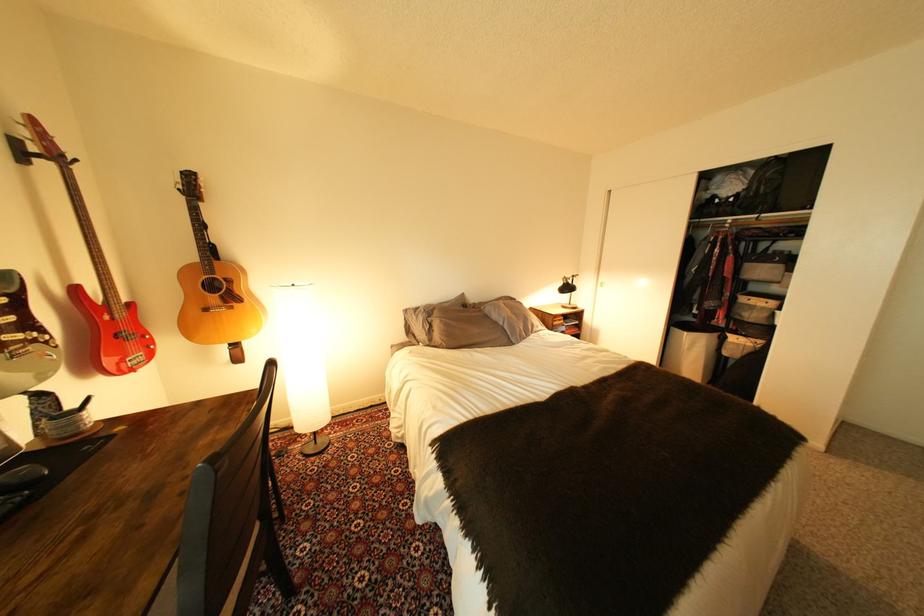
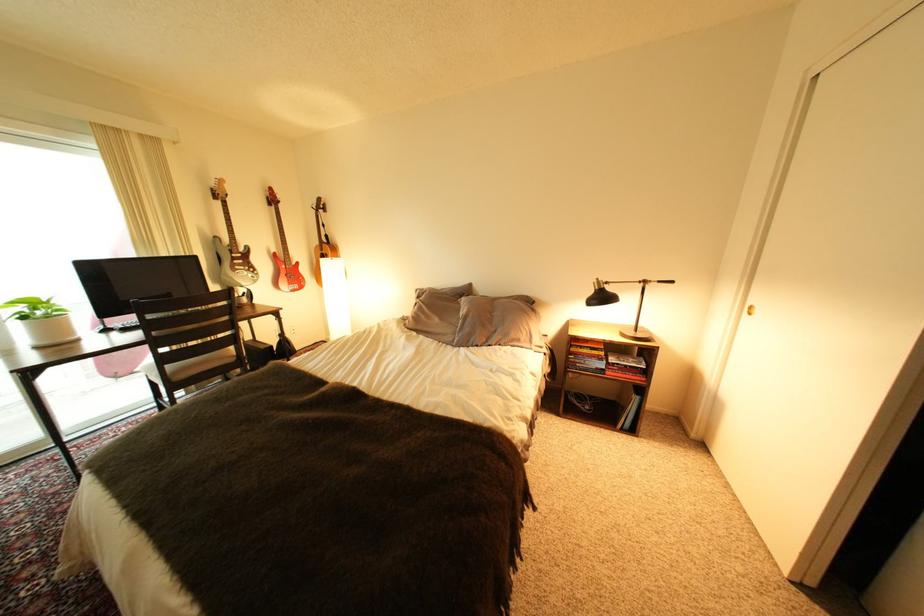
In the second image, find the point that corresponds to the point at 578,326 in the first image.

(623, 363)